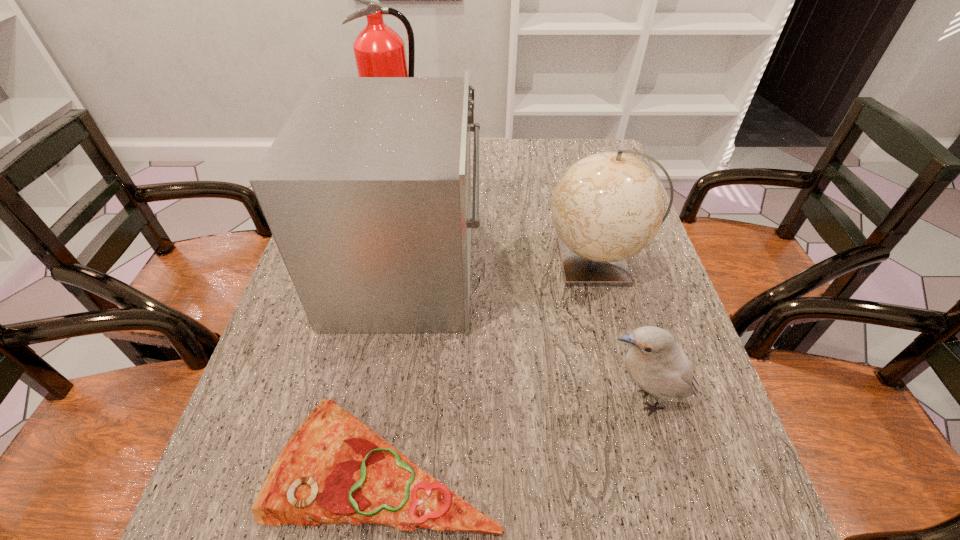
You are a GUI agent. You are given a task and a screenshot of the screen. Output one action in this format:
    pyautogui.click(x=<x>, y=<y>)
    Task: Click on the vacant area situated 0.210m at the beak of the bird
    This screenshot has height=540, width=960.
    Given the screenshot: What is the action you would take?
    pyautogui.click(x=488, y=400)

Locate an element on the screen. free region located at the beak of the bird is located at coordinates (555, 400).

Where is `vacant space located at the beak of the bird`? This screenshot has height=540, width=960. vacant space located at the beak of the bird is located at coordinates (549, 400).

At what (x,y) coordinates should I click in order to perform the action: click on free space located 0.230m on the back of the shortest object. Please return your answer as a coordinate pair (x, y). Looking at the image, I should click on (408, 311).

In order to click on object that is at the far edge in this screenshot , I will do `click(379, 51)`.

You are a GUI agent. You are given a task and a screenshot of the screen. Output one action in this format:
    pyautogui.click(x=<x>, y=<y>)
    Task: Click on the object at the near edge
    
    Given the screenshot: What is the action you would take?
    pyautogui.click(x=334, y=469)

Where is `fire extinguisher present at the left edge`? fire extinguisher present at the left edge is located at coordinates (379, 51).

Find the location of a particular element. This screenshot has height=540, width=960. toaster oven at the left edge is located at coordinates (366, 190).

What are the coordinates of `pizza located at the left edge` in the screenshot? It's located at (334, 469).

Find the location of `globe that is at the right edge`. globe that is at the right edge is located at coordinates (608, 206).